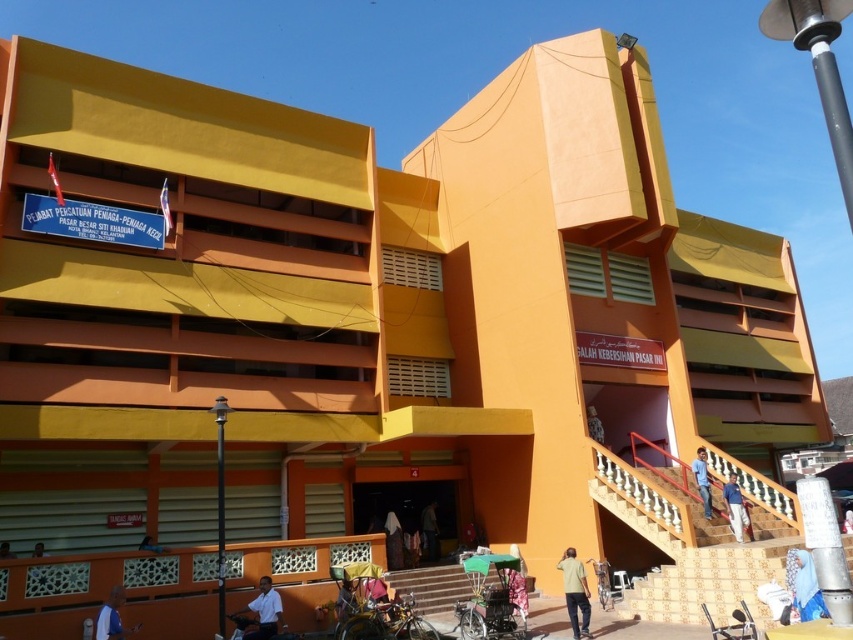
You are a photographer standing at the base of the building and see the light yellow shirt at center and the matte black person at lower left. Which of these two figures is closer to you?

The light yellow shirt at center is larger in size than the matte black person at lower left, so the light yellow shirt at center is closer to you.

You are a photographer taking a picture of the building. You notice a white matte shirt at lower center and a dark brown fabric at center in your frame. Which object should you adjust your focus on if you want to capture the larger object clearly?

The white matte shirt at lower center is larger in size than the dark brown fabric at center, so you should focus on the white matte shirt at lower center to capture the larger object clearly.